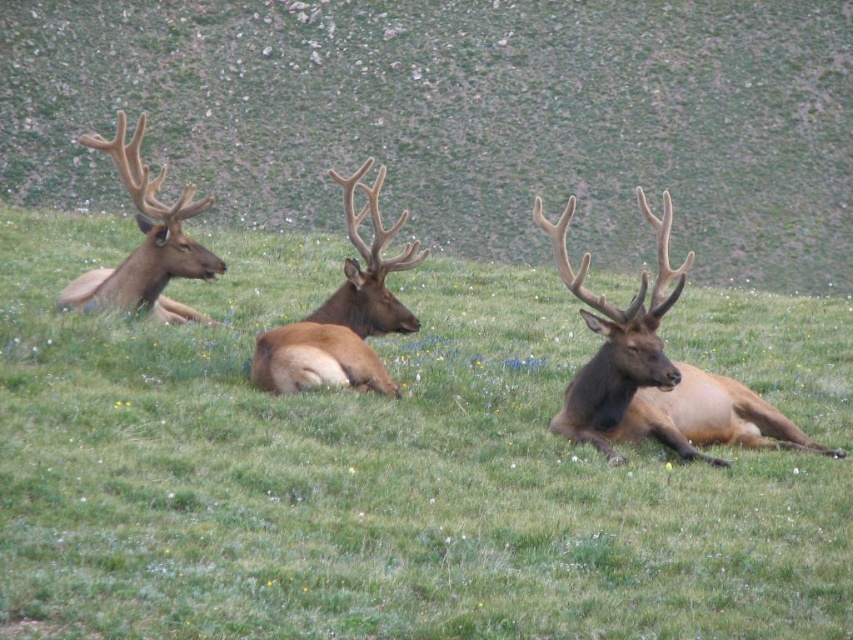
You are a photographer trying to capture a clear shot of the brown velvet antlers at left without the green grass at center blocking the view. Based on their positions, can you adjust your angle to see the antlers without the grass in front?

The green grass at center is in front of the brown velvet antlers at left, so adjusting your angle to look behind the grass might allow you to see the antlers without obstruction.

You are an animal researcher observing the scene. You notice the brown velvet deer at center and the brown velvet antler at center. Which object is located below the other?

The brown velvet deer at center is positioned under the brown velvet antler at center, meaning the deer is below the antler.

You are a photographer trying to capture the brown velvet antlers at left and the green grass at center in a single frame. Given that your camera can only focus on objects within a 1.5 meter width, will both fit in the frame if they are side by side?

The green grass at center is wider than the brown velvet antlers at left. Since the camera can focus on objects within a 1.5 meter width, both can fit side by side as long as their combined width does not exceed 1.5 meters. However, the exact fit depends on their individual widths, which are not specified here.